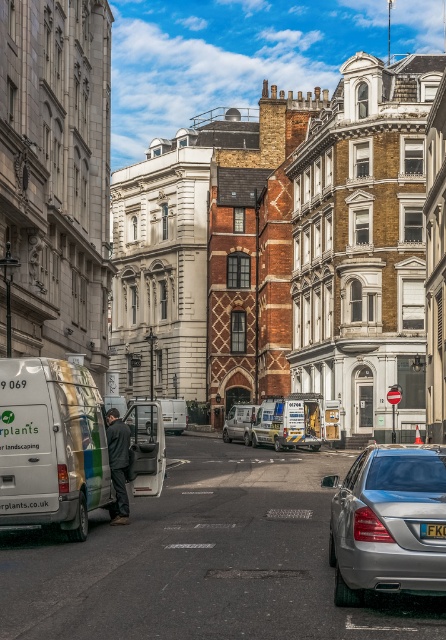
Question: Which point is farther to the camera?

Choices:
 (A) (255, 445)
 (B) (250, 413)
 (C) (77, 486)
 (D) (185, 412)

Answer: (D)

Question: Does white matte van at center lie behind black plastic license plate at center?

Choices:
 (A) no
 (B) yes

Answer: (B)

Question: Which of these objects is positioned closest to the dark gray jacket at center?

Choices:
 (A) white metallic van at lower left
 (B) blue metallic ambulance at center
 (C) white matte van at center

Answer: (A)

Question: Which point is farther to the camera?

Choices:
 (A) (367, 500)
 (B) (143, 397)

Answer: (B)

Question: Is dark gray jacket at center to the right of metallic silver van at center from the viewer's perspective?

Choices:
 (A) yes
 (B) no

Answer: (B)

Question: Is white matte van at center positioned at the back of black plastic license plate at center?

Choices:
 (A) yes
 (B) no

Answer: (A)